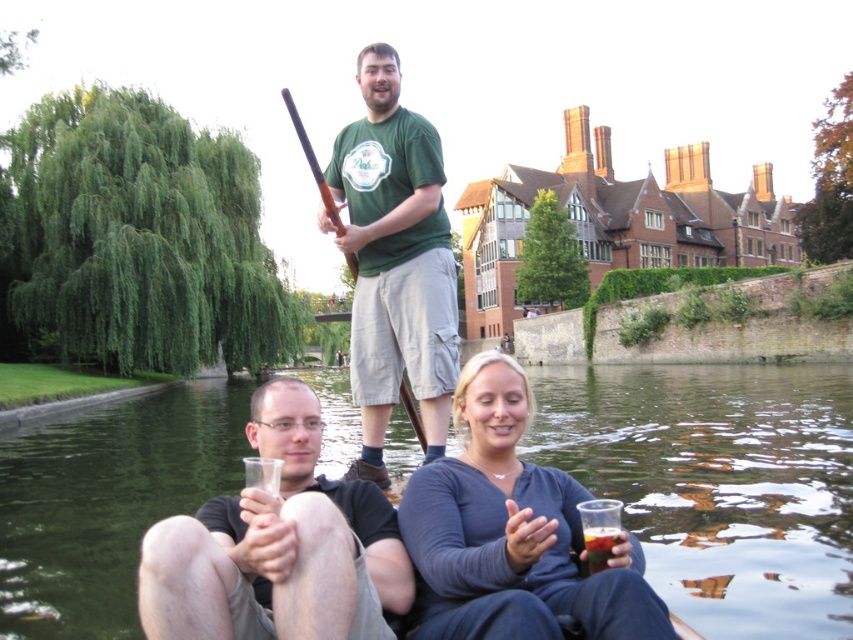
You are standing on the boat and want to pour your drink into the river. Where should you pour it to ensure it lands in the greenish water at center?

You should pour your drink towards the center of the river where the greenish water at center is located at point coordinates (718, 483).